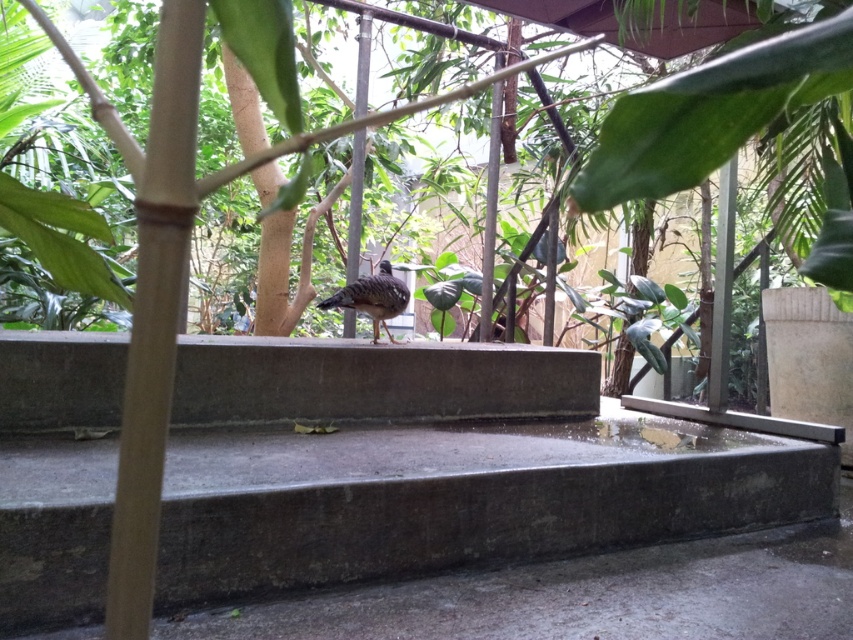
You are a person who is 1.8 meters tall and standing in the garden scene. You want to step onto the concrete stairs at center. Considering your height, can you safely step onto the stairs without bending down?

The concrete stairs at center are 1.77 meters away from the viewer. Since the person is 1.8 meters tall, they can likely step onto the stairs without bending down as the distance is slightly less than their height, allowing comfortable reach.

You are standing in the garden and want to place a small statue between the two points, point (259, 452) and point (393, 304). Which point should the statue be closer to if you want it to be nearer to the bird on the concrete ledge?

The statue should be placed closer to point (259, 452) because it is closer to the viewer, making it nearer to the bird on the concrete ledge.